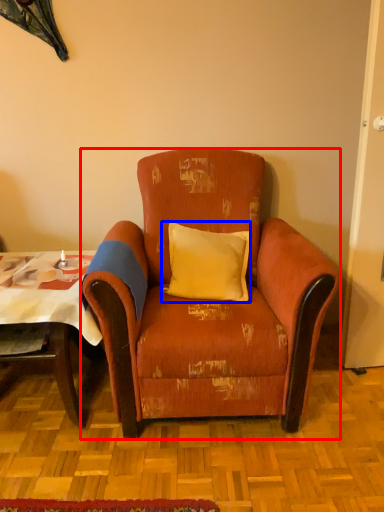
Question: Which object appears closest to the camera in this image, chair (highlighted by a red box) or pillow (highlighted by a blue box)?

Choices:
 (A) chair
 (B) pillow

Answer: (A)